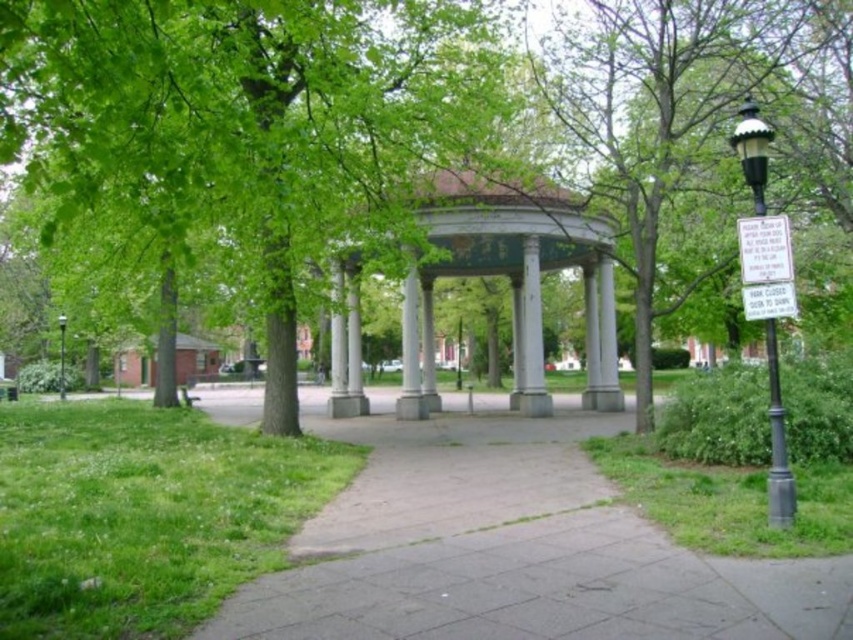
You are a park visitor standing at the entrance of the park. You see the white marble gazebo at center and the black metal streetlight at right. Which object is closer to you?

The white marble gazebo at center is closer to you because it is positioned over the black metal streetlight at right, indicating it is in front of it.

You are planning to install a new bench in the park. The bench requires a space wider than the black metal streetlight at right. Can the gray concrete pavement at center accommodate the bench?

The gray concrete pavement at center has a width larger than the black metal streetlight at right, so yes, the bench can be placed there since the pavement is wider than the required space.